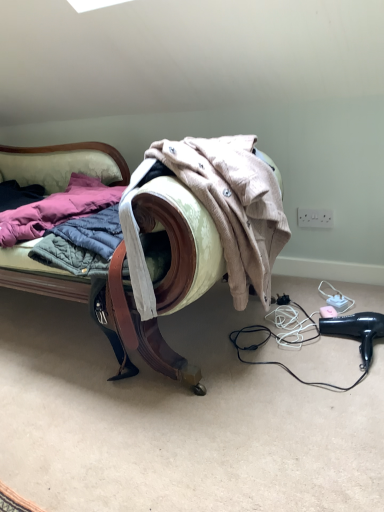
Question: Considering their positions, is black plastic hair dryer at lower right located in front of or behind wooden armchair at center?

Choices:
 (A) behind
 (B) front

Answer: (A)

Question: In terms of size, does black plastic hair dryer at lower right appear bigger or smaller than wooden armchair at center?

Choices:
 (A) big
 (B) small

Answer: (B)

Question: From a real-world perspective, relative to wooden armchair at center, is black plastic hair dryer at lower right vertically above or below?

Choices:
 (A) below
 (B) above

Answer: (A)

Question: Is wooden armchair at center wider or thinner than black plastic hair dryer at lower right?

Choices:
 (A) thin
 (B) wide

Answer: (B)

Question: Is point (150, 337) closer or farther from the camera than point (362, 357)?

Choices:
 (A) closer
 (B) farther

Answer: (A)

Question: Is wooden armchair at center spatially inside black plastic hair dryer at lower right, or outside of it?

Choices:
 (A) outside
 (B) inside

Answer: (A)

Question: From a real-world perspective, is wooden armchair at center physically located above or below black plastic hair dryer at lower right?

Choices:
 (A) below
 (B) above

Answer: (B)